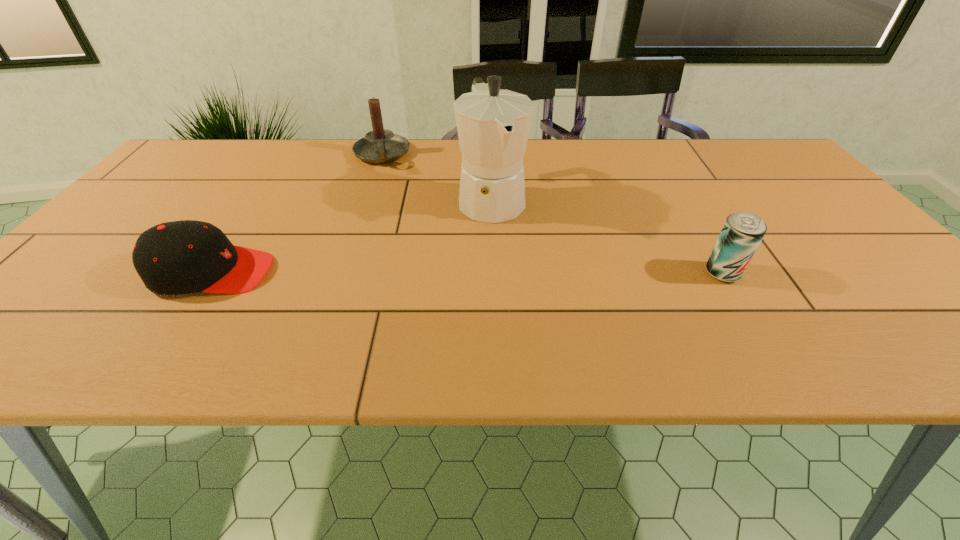
Where is `free space on the desktop that is between the leftmost object and the rightmost object and is positioned on the side of the candle with the handle loop`? The height and width of the screenshot is (540, 960). free space on the desktop that is between the leftmost object and the rightmost object and is positioned on the side of the candle with the handle loop is located at coordinates (396, 273).

You are a GUI agent. You are given a task and a screenshot of the screen. Output one action in this format:
    pyautogui.click(x=<x>, y=<y>)
    Task: Click on the vacant space on the desktop that is between the leftmost object and the beer can and is positioned at the spout of the second object from right to left
    Image resolution: width=960 pixels, height=540 pixels.
    Given the screenshot: What is the action you would take?
    pyautogui.click(x=530, y=273)